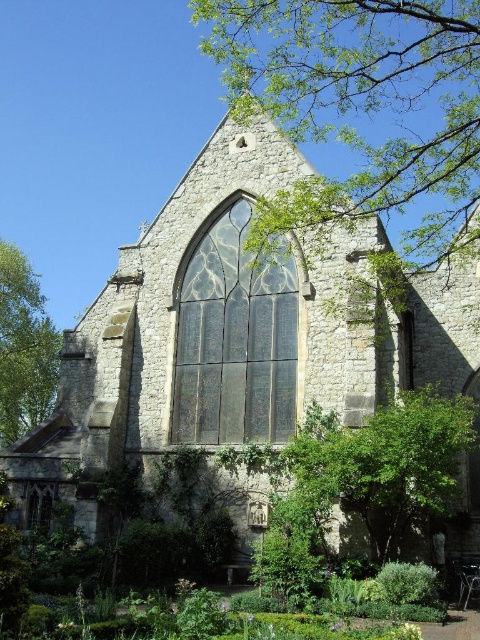
Question: Which object is closer to the camera taking this photo?

Choices:
 (A) green leafy tree at upper center
 (B) green leafy tree at left

Answer: (A)

Question: Can you confirm if green leafy tree at upper center is smaller than green leafy tree at left?

Choices:
 (A) no
 (B) yes

Answer: (A)

Question: Can you confirm if green leafy tree at upper center is wider than green leafy tree at left?

Choices:
 (A) yes
 (B) no

Answer: (A)

Question: Does green leafy tree at upper center appear over green leafy tree at left?

Choices:
 (A) no
 (B) yes

Answer: (B)

Question: Among these points, which one is nearest to the camera?

Choices:
 (A) (19, 291)
 (B) (387, 147)

Answer: (B)